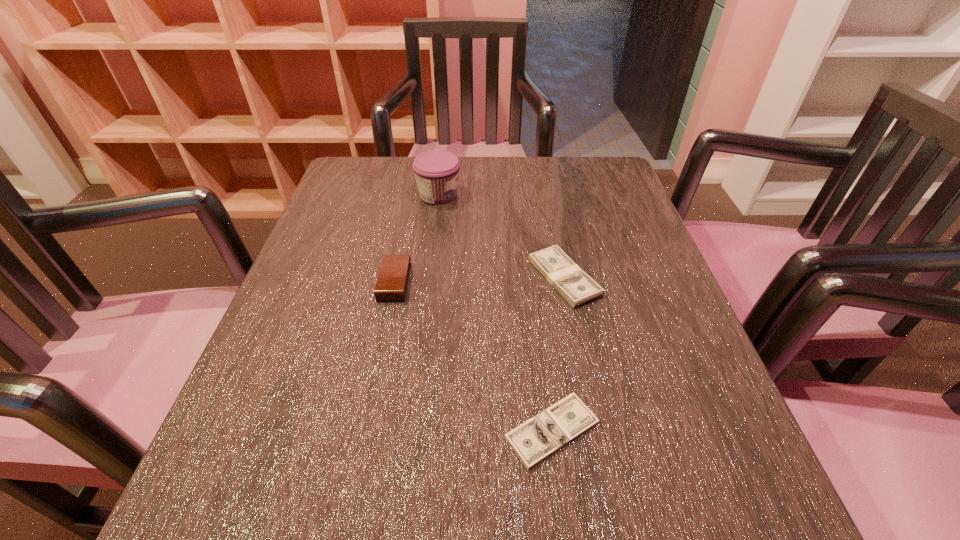
Choose which object is the nearest neighbor to the third shortest object. Please provide its 2D coordinates. Your answer should be formatted as a tuple, i.e. [(x, y)], where the tuple contains the x and y coordinates of a point satisfying the conditions above.

[(437, 172)]

Locate which object is the second closest to the shortest object. Please provide its 2D coordinates. Your answer should be formatted as a tuple, i.e. [(x, y)], where the tuple contains the x and y coordinates of a point satisfying the conditions above.

[(392, 282)]

Where is `free space that satisfies the following two spatial constraints: 1. on the front face of the second tallest object; 2. on the left side of the shorter dollar`? The image size is (960, 540). free space that satisfies the following two spatial constraints: 1. on the front face of the second tallest object; 2. on the left side of the shorter dollar is located at coordinates (365, 430).

In order to click on free spot that satisfies the following two spatial constraints: 1. on the back side of the second shortest object; 2. on the front label of the farthest object in this screenshot , I will do `click(547, 194)`.

Find the location of a particular element. The height and width of the screenshot is (540, 960). blank space that satisfies the following two spatial constraints: 1. on the front label of the nearest object; 2. on the left side of the tallest object is located at coordinates (409, 430).

Where is `free space that satisfies the following two spatial constraints: 1. on the front label of the taller dollar; 2. on the left side of the tallest object`? free space that satisfies the following two spatial constraints: 1. on the front label of the taller dollar; 2. on the left side of the tallest object is located at coordinates (428, 278).

You are a GUI agent. You are given a task and a screenshot of the screen. Output one action in this format:
    pyautogui.click(x=<x>, y=<y>)
    Task: Click on the free space in the image that satisfies the following two spatial constraints: 1. on the front label of the jam; 2. on the left side of the shorter dollar
    This screenshot has height=540, width=960.
    Given the screenshot: What is the action you would take?
    (x=409, y=430)

Image resolution: width=960 pixels, height=540 pixels. In order to click on vacant position in the image that satisfies the following two spatial constraints: 1. on the back side of the nearest object; 2. on the front label of the jam in this screenshot , I will do `click(522, 194)`.

This screenshot has width=960, height=540. In order to click on free space that satisfies the following two spatial constraints: 1. on the front label of the nearer dollar; 2. on the right side of the jam in this screenshot , I will do `click(409, 430)`.